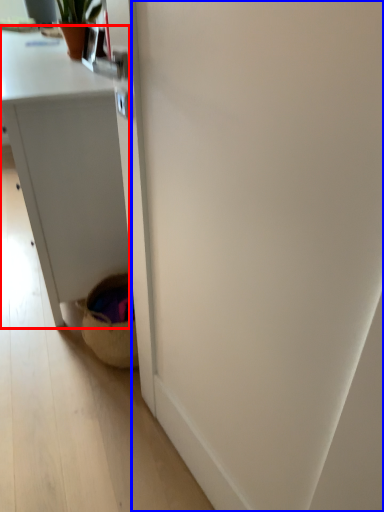
Question: Which object appears closest to the camera in this image, desk (highlighted by a red box) or screen door (highlighted by a blue box)?

Choices:
 (A) desk
 (B) screen door

Answer: (B)